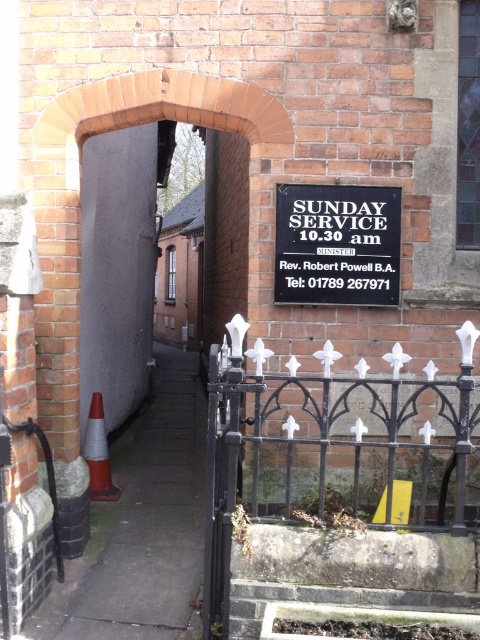
Can you confirm if gray concrete door at left is positioned to the right of orange reflective cone at lower left?

Incorrect, gray concrete door at left is not on the right side of orange reflective cone at lower left.

What do you see at coordinates (117, 269) in the screenshot? Image resolution: width=480 pixels, height=640 pixels. I see `gray concrete door at left` at bounding box center [117, 269].

The height and width of the screenshot is (640, 480). I want to click on gray concrete door at left, so click(x=117, y=269).

From the picture: Who is higher up, black wrought iron fence at right or gray concrete door at left?

Positioned higher is gray concrete door at left.

Who is taller, black wrought iron fence at right or gray concrete door at left?

With more height is black wrought iron fence at right.

This screenshot has width=480, height=640. In order to click on black wrought iron fence at right in this screenshot , I will do `click(339, 490)`.

The width and height of the screenshot is (480, 640). What are the coordinates of `black wrought iron fence at right` in the screenshot? It's located at click(339, 490).

Can you confirm if black wrought iron fence at right is shorter than black metal sign at center?

Incorrect, black wrought iron fence at right's height does not fall short of black metal sign at center's.

Is point (207, 422) positioned after point (387, 211)?

No, (207, 422) is closer to viewer.

Between point (276, 428) and point (382, 262), which one is positioned behind?

The point (276, 428) is more distant.

Image resolution: width=480 pixels, height=640 pixels. Identify the location of black wrought iron fence at right. (339, 490).